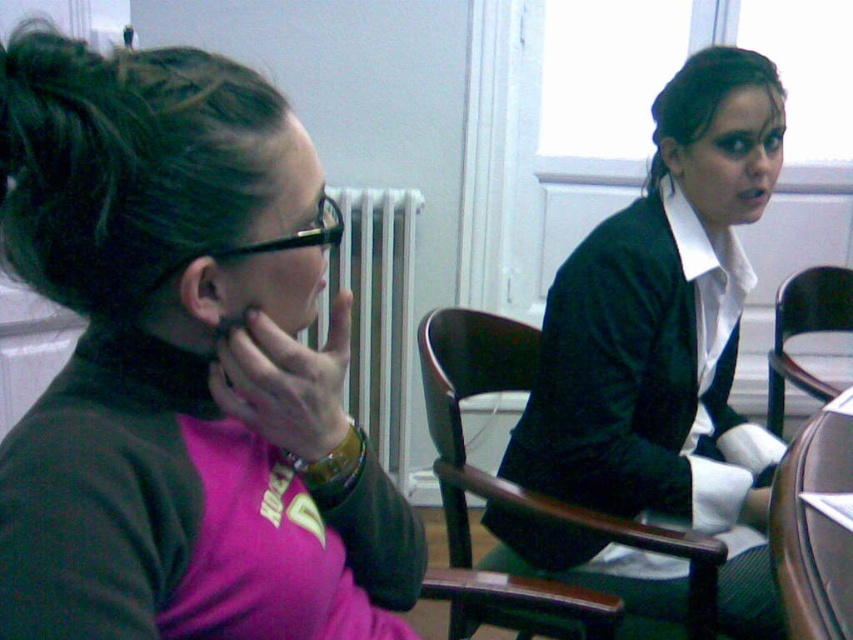
This screenshot has height=640, width=853. Find the location of `pink matte turtleneck at left`. pink matte turtleneck at left is located at coordinates (183, 365).

Does pink matte turtleneck at left have a lesser width compared to velvet green dress at center?

Correct, pink matte turtleneck at left's width is less than velvet green dress at center's.

Based on the photo, who is more distant from viewer, (x=306, y=452) or (x=578, y=305)?

Point (x=578, y=305)

Where is `pink matte turtleneck at left`? The height and width of the screenshot is (640, 853). pink matte turtleneck at left is located at coordinates (183, 365).

Based on the photo, can you confirm if dark wood chair at center is taller than white radiator at center?

Incorrect, dark wood chair at center's height is not larger of white radiator at center's.

Where is `dark wood chair at center`? dark wood chair at center is located at coordinates (503, 480).

Which is more to the right, dark wood chair at center or brown leather round table at lower right?

brown leather round table at lower right is more to the right.

The height and width of the screenshot is (640, 853). What do you see at coordinates (503, 480) in the screenshot?
I see `dark wood chair at center` at bounding box center [503, 480].

Locate an element on the screen. The width and height of the screenshot is (853, 640). dark wood chair at center is located at coordinates (503, 480).

Image resolution: width=853 pixels, height=640 pixels. Identify the location of dark wood chair at center. (503, 480).